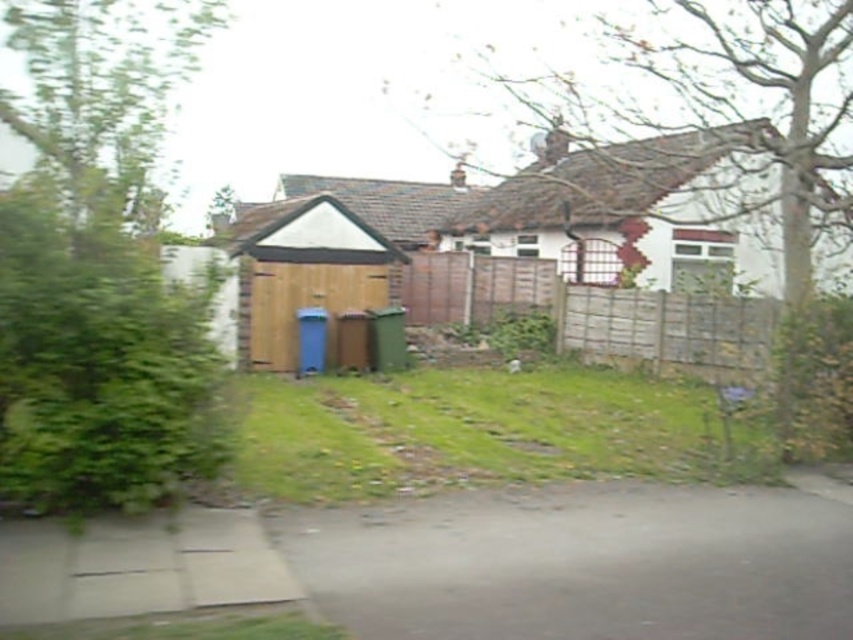
You are a landscape architect planning to plant a new tree in this residential area. Considering the space available between the brown leafy tree at upper center and the green leafy tree at upper left, which tree has a wider spread and should be considered for spacing requirements?

The brown leafy tree at upper center has a larger width than the green leafy tree at upper left, so it should be considered for spacing requirements due to its wider spread.

Looking at the residential scene, there is a brown leafy tree at upper center and a green leafy tree at upper left. Which tree is positioned to the right side of the other?

The brown leafy tree at upper center is positioned to the right of the green leafy tree at upper left.